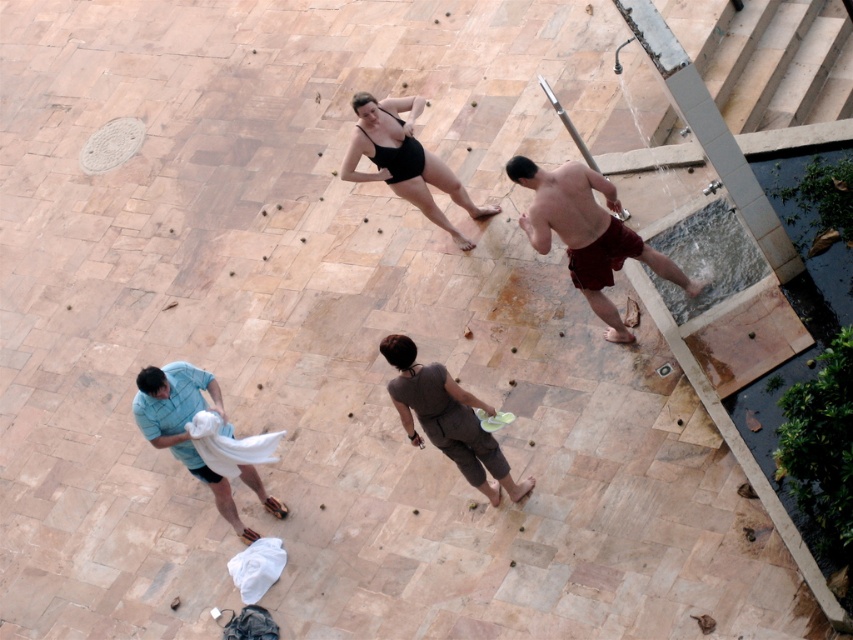
You are standing on the patio and want to hand an object to both the person wearing the black matte swimsuit at center and the person wearing the blue cotton shirt at lower left. If you can only walk 8 feet before needing to rest, can you reach both individuals without resting?

The black matte swimsuit at center and blue cotton shirt at lower left are 7.29 feet apart. Since the total distance to both is within the 8 feet limit, you can reach both without resting.

You are a photographer trying to capture a candid shot of the two individuals wearing black matte swimsuit at center and black matte bikini top at upper center. Since you want to ensure both are in focus, you need to know which one is taller. Can you tell me which one is taller?

The black matte swimsuit at center is taller than the black matte bikini top at upper center, so the swimsuit is taller.